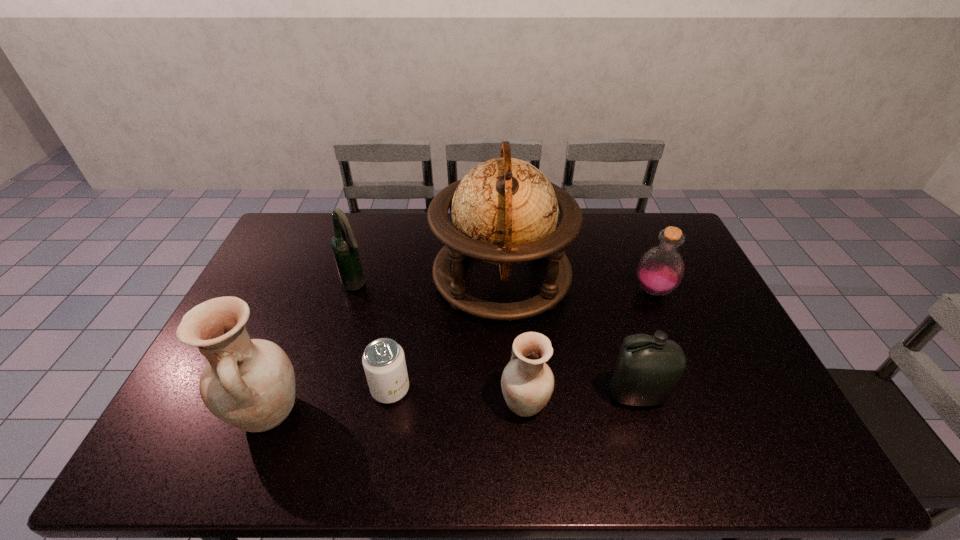
This screenshot has height=540, width=960. I want to click on the left pottery, so click(249, 384).

I want to click on the shorter pottery, so click(x=527, y=382).

Find the location of a particular element. the tallest object is located at coordinates (504, 211).

Where is `the third tallest object`? This screenshot has height=540, width=960. the third tallest object is located at coordinates [344, 247].

The width and height of the screenshot is (960, 540). Identify the location of the farther bottle. (660, 270).

Identify the location of the right bottle. This screenshot has height=540, width=960. click(660, 270).

Locate an element on the screen. The height and width of the screenshot is (540, 960). the second object from right to left is located at coordinates (648, 368).

You are a GUI agent. You are given a task and a screenshot of the screen. Output one action in this format:
    pyautogui.click(x=<x>, y=<y>)
    Task: Click on the nearer bottle
    This screenshot has width=960, height=540.
    Given the screenshot: What is the action you would take?
    pyautogui.click(x=648, y=368)

I want to click on soda can, so click(x=384, y=363).

Where is `the shortest object`? Image resolution: width=960 pixels, height=540 pixels. the shortest object is located at coordinates (384, 363).